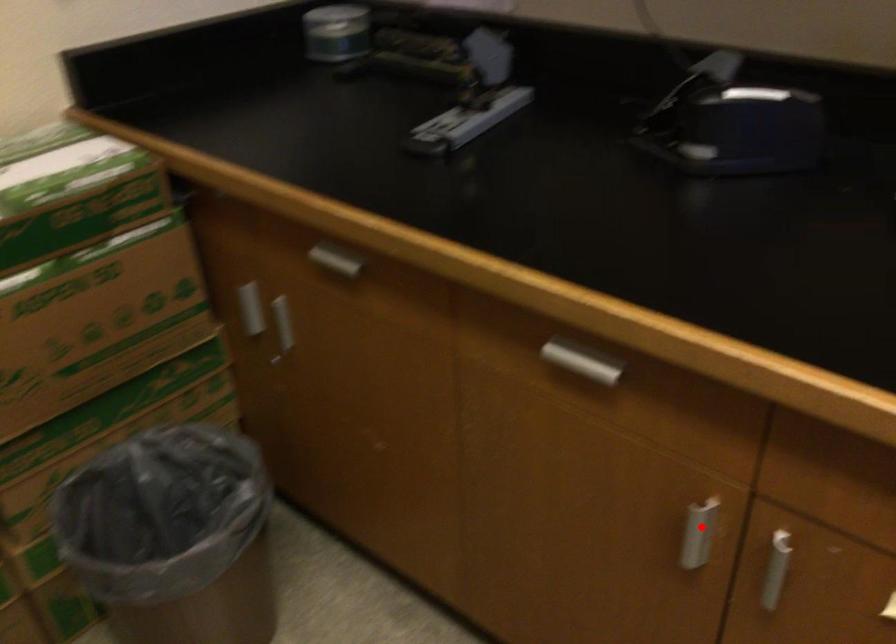
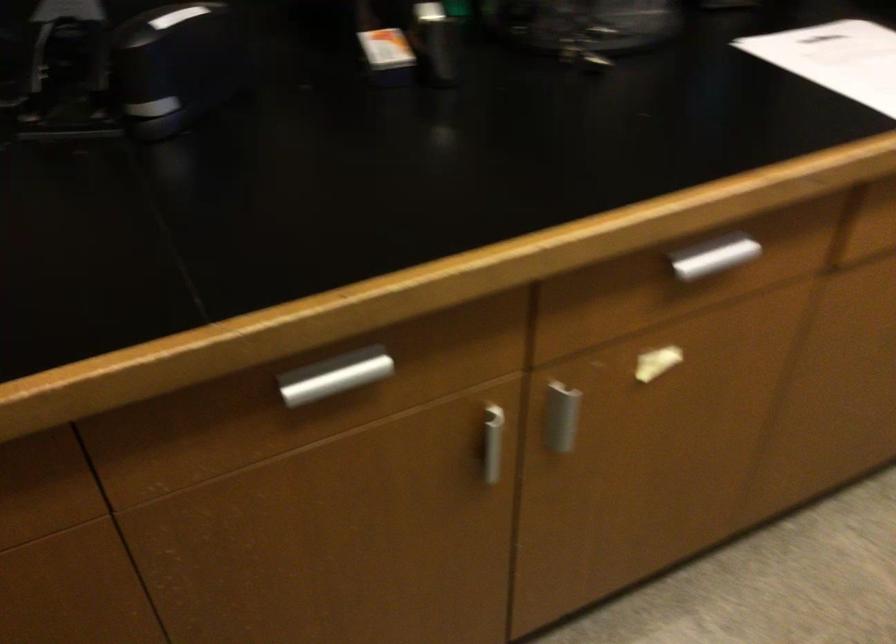
Find the pixel in the second image that matches the highlighted location in the first image.

(487, 442)